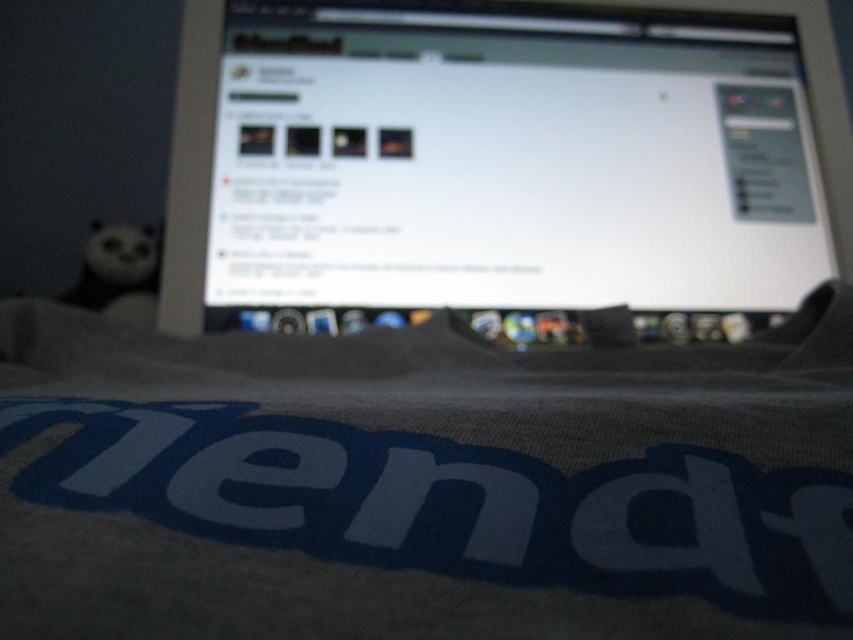
Does matte plastic monitor at center lie in front of black plush panda at left?

Yes.

Does matte plastic monitor at center have a greater width compared to black plush panda at left?

Yes, matte plastic monitor at center is wider than black plush panda at left.

Is point (590, 294) closer to camera compared to point (140, 320)?

Yes, it is in front of point (140, 320).

Where is `matte plastic monitor at center`? This screenshot has height=640, width=853. matte plastic monitor at center is located at coordinates (505, 164).